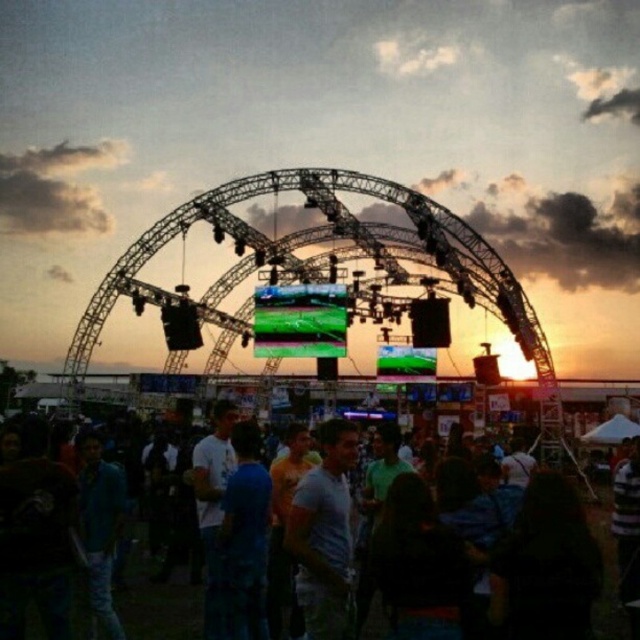
Between point (333, 586) and point (124, 624), which one is positioned in front?

Positioned in front is point (124, 624).

Is white cotton shirt at center further to camera compared to dark blue casual shirt at center?

Yes, white cotton shirt at center is further from the viewer.

Find the location of a particular element. white cotton shirt at center is located at coordinates (324, 532).

Identify the location of white cotton shirt at center. The height and width of the screenshot is (640, 640). (324, 532).